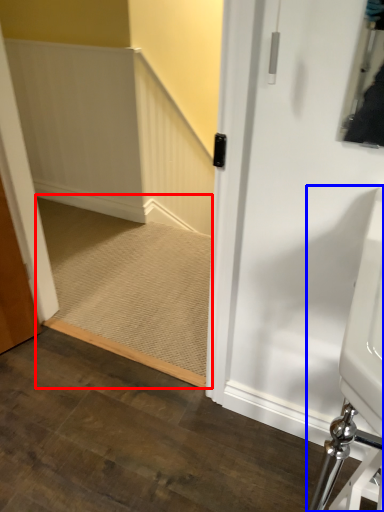
Question: Among these objects, which one is nearest to the camera, stairs (highlighted by a red box) or sink (highlighted by a blue box)?

Choices:
 (A) stairs
 (B) sink

Answer: (B)